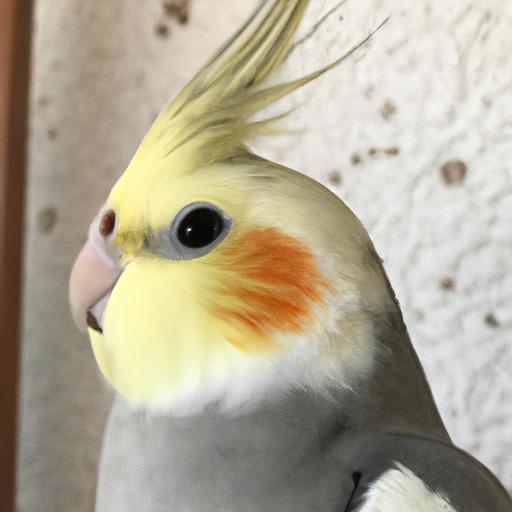
You are a GUI agent. You are given a task and a screenshot of the screen. Output one action in this format:
    pyautogui.click(x=<x>, y=<y>)
    Task: Click on the wall
    
    Given the screenshot: What is the action you would take?
    pyautogui.click(x=407, y=168)